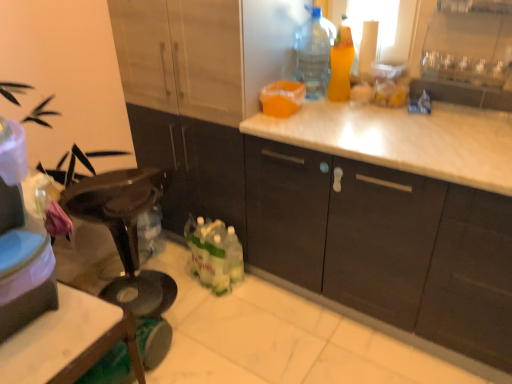
The height and width of the screenshot is (384, 512). In order to click on vacant area in front of translucent orange spray bottle at upper right, marked as the 1th bottle in a right-to-left arrangement in this screenshot , I will do `click(328, 109)`.